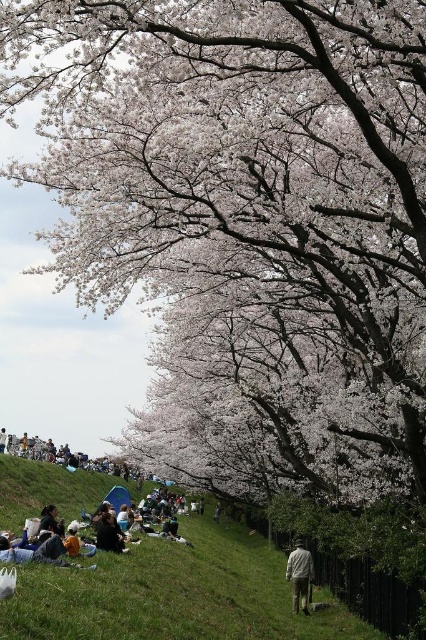
You are planning to set up a small picnic blanket for two people in the scene. Given the sizes of the green grassy hillside at lower center and the light brown fabric jacket at lower center, which object would provide enough space for the blanket?

The green grassy hillside at lower center is larger in size than the light brown fabric jacket at lower center, so the green grassy hillside at lower center would provide enough space for the picnic blanket.

You are standing at the cherry blossom embankment and want to take a photo of the two points marked in the scene. Which point, point [69,524] or point [117,524], is closer to you?

Point [69,524] is closer to you because it is further to the viewer than point [117,524].

You are standing in the cherry blossom area and see the dark gray fabric bag at lower center and the dark brown hair at lower center. Which object is positioned more to the left side?

The dark gray fabric bag at lower center is positioned more to the left side than the dark brown hair at lower center.